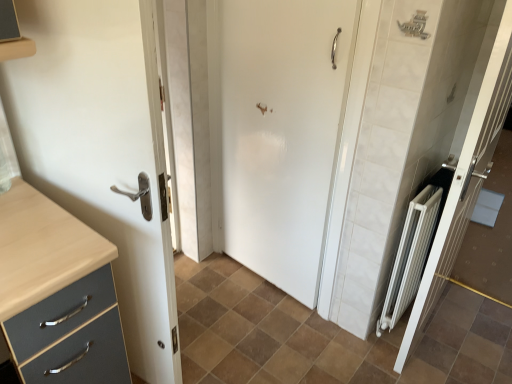
Question: Considering the relative sizes of white matte door at center, arranged as the 2th door when viewed from the left, and white glossy door at left, marked as the 1th door in a left-to-right arrangement, in the image provided, is white matte door at center, arranged as the 2th door when viewed from the left, shorter than white glossy door at left, marked as the 1th door in a left-to-right arrangement,?

Choices:
 (A) yes
 (B) no

Answer: (A)

Question: Is white matte door at center, arranged as the second door when viewed from the right, completely or partially outside of white glossy door at left, which appears as the third door when viewed from the right?

Choices:
 (A) yes
 (B) no

Answer: (A)

Question: Can you confirm if white matte door at center, arranged as the second door when viewed from the right, is smaller than white glossy door at left, which appears as the third door when viewed from the right?

Choices:
 (A) no
 (B) yes

Answer: (B)

Question: Is white matte door at center, arranged as the second door when viewed from the right, to the left of white glossy door at left, marked as the 1th door in a left-to-right arrangement, from the viewer's perspective?

Choices:
 (A) yes
 (B) no

Answer: (B)

Question: Is the position of white matte door at center, arranged as the 2th door when viewed from the left, less distant than that of white glossy door at left, marked as the 1th door in a left-to-right arrangement?

Choices:
 (A) yes
 (B) no

Answer: (B)

Question: Is white matte door at center, arranged as the 2th door when viewed from the left, positioned with its back to white glossy door at left, marked as the 1th door in a left-to-right arrangement?

Choices:
 (A) yes
 (B) no

Answer: (A)

Question: Is brown matte tile at center far from white glossy door at left, marked as the 1th door in a left-to-right arrangement?

Choices:
 (A) no
 (B) yes

Answer: (A)

Question: Considering the relative positions of brown matte tile at center and white glossy door at left, which appears as the third door when viewed from the right, in the image provided, is brown matte tile at center to the right of white glossy door at left, which appears as the third door when viewed from the right, from the viewer's perspective?

Choices:
 (A) yes
 (B) no

Answer: (A)

Question: Does brown matte tile at center have a smaller size compared to white glossy door at left, marked as the 1th door in a left-to-right arrangement?

Choices:
 (A) no
 (B) yes

Answer: (B)

Question: Is brown matte tile at center turned away from white glossy door at left, marked as the 1th door in a left-to-right arrangement?

Choices:
 (A) yes
 (B) no

Answer: (B)

Question: From a real-world perspective, is brown matte tile at center positioned over white glossy door at left, which appears as the third door when viewed from the right, based on gravity?

Choices:
 (A) no
 (B) yes

Answer: (A)

Question: Does brown matte tile at center have a lesser width compared to white glossy door at left, which appears as the third door when viewed from the right?

Choices:
 (A) no
 (B) yes

Answer: (A)

Question: Can you confirm if white metallic radiator at right, marked as the 1th door in a right-to-left arrangement, is smaller than white glossy door at left, which appears as the third door when viewed from the right?

Choices:
 (A) yes
 (B) no

Answer: (A)